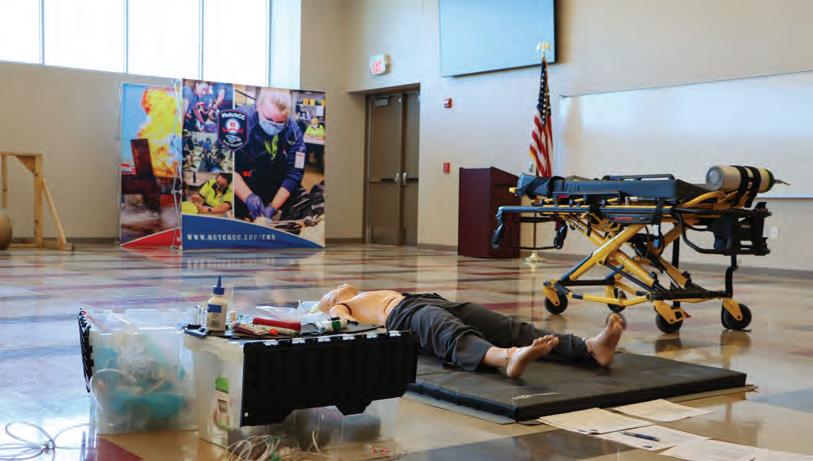
Identify the location of poster. The width and height of the screenshot is (813, 461). (228, 225).